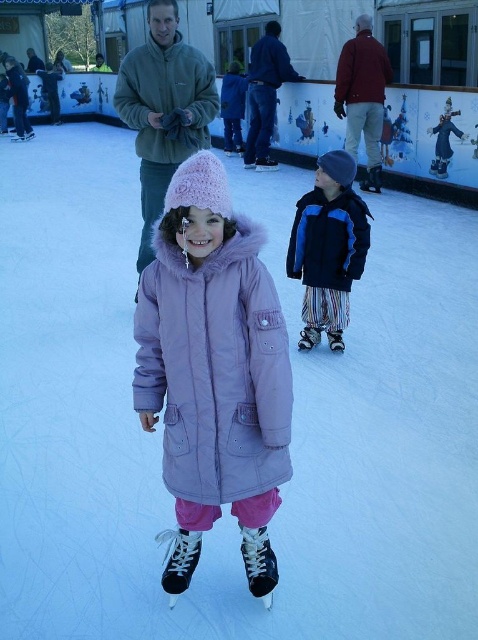
You are a photographer trying to capture both the blue fleece jacket at center and the matte red jacket at upper center in the same frame. Given their sizes, which jacket will appear larger in the photo?

The blue fleece jacket at center will appear larger in the photo because it is bigger than the matte red jacket at upper center.

Based on the scene description, can you determine if the dark blue jacket at center is wider than the matte red jacket at upper center?

The dark blue jacket at center is wider than the matte red jacket at upper center according to the description.

What is the exact location of the blue fleece jacket at center in the image?

The blue fleece jacket at center is located at point coordinates of (x=327, y=248).